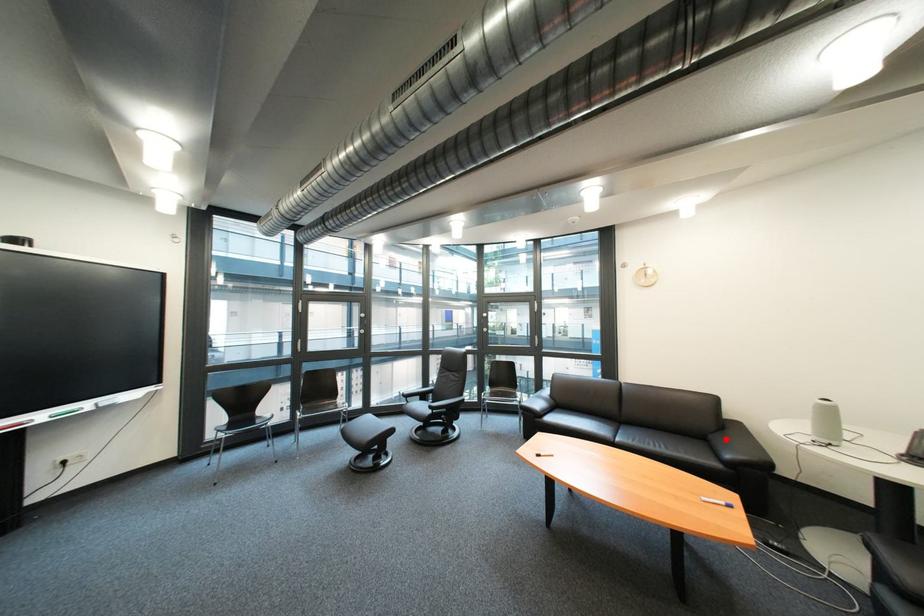
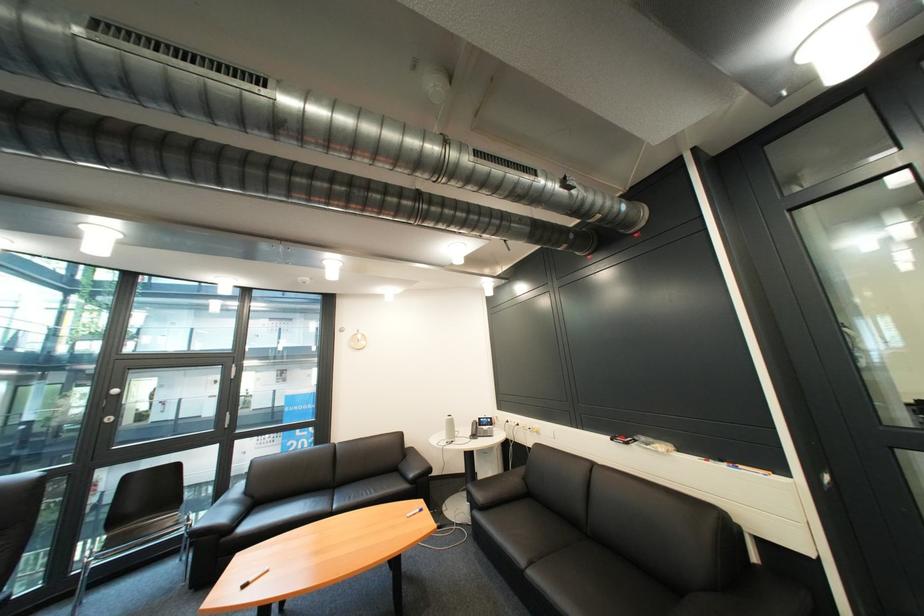
The point at the highlighted location is marked in the first image. Where is the corresponding point in the second image?

(414, 468)